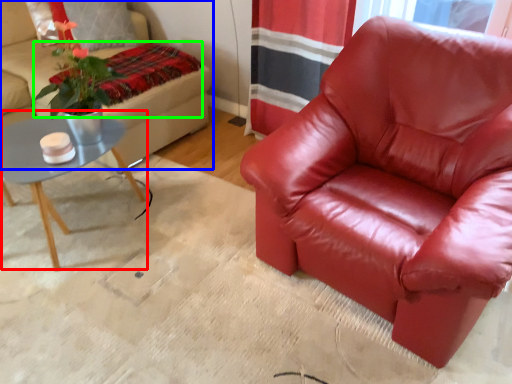
Question: Which object is positioned farthest from coffee table (highlighted by a red box)? Select from studio couch (highlighted by a blue box) and blanket (highlighted by a green box).

Choices:
 (A) studio couch
 (B) blanket

Answer: (B)